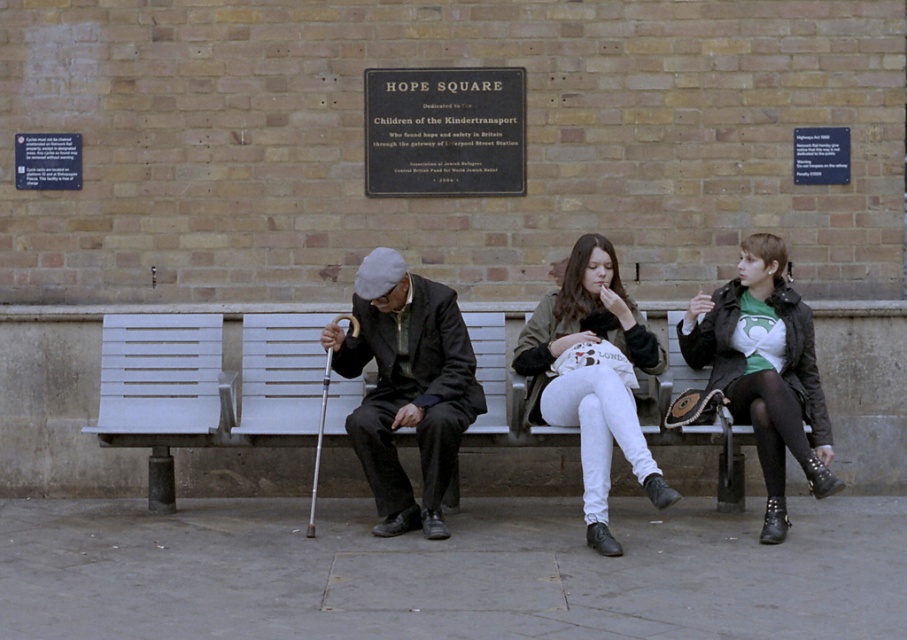
Question: Which object is the closest to the white cotton pants at center?

Choices:
 (A) white wooden bench at center
 (B) dark gray woolen hat at center

Answer: (B)

Question: Can you confirm if dark gray woolen hat at center is positioned to the right of white cotton pants at center?

Choices:
 (A) yes
 (B) no

Answer: (B)

Question: Which point is farther from the camera taking this photo?

Choices:
 (A) (608, 416)
 (B) (387, 310)

Answer: (B)

Question: Does green jersey at center have a larger size compared to white cotton pants at center?

Choices:
 (A) yes
 (B) no

Answer: (B)

Question: Which is farther from the green jersey at center?

Choices:
 (A) white cotton pants at center
 (B) dark gray woolen hat at center
 (C) white wooden bench at center

Answer: (C)

Question: In this image, where is dark gray woolen hat at center located relative to green jersey at center?

Choices:
 (A) right
 (B) left

Answer: (B)